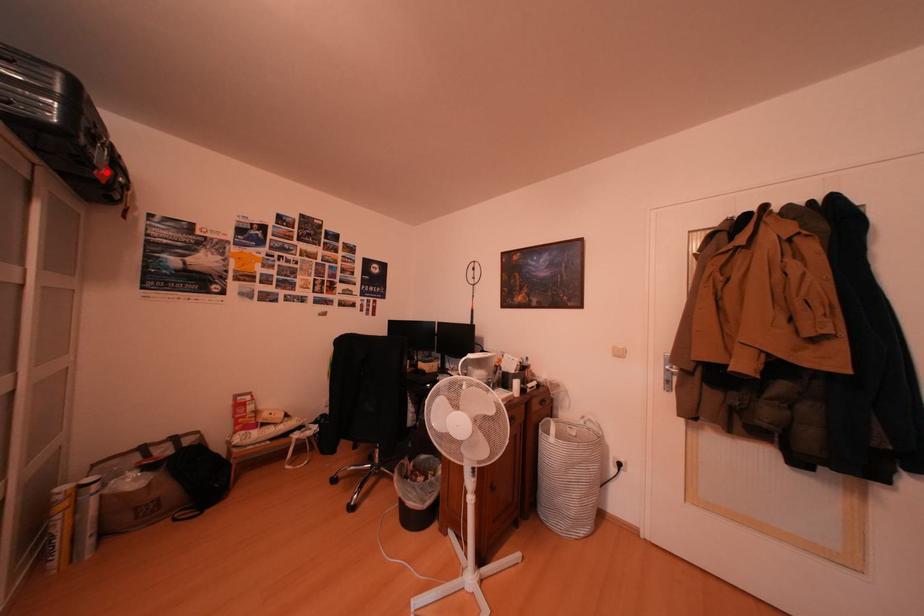
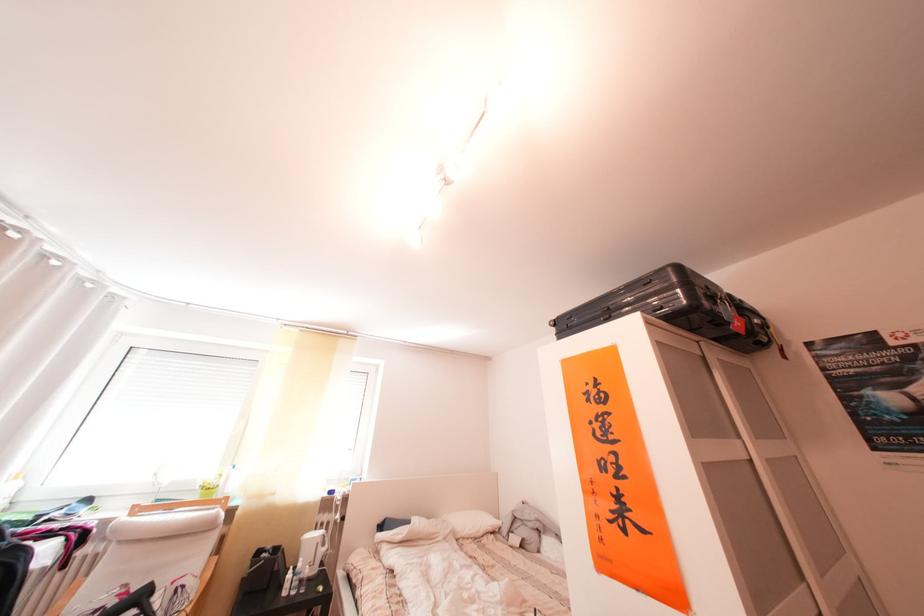
Question: I am providing you with two images of the same scene from different viewpoints. A red point is marked on the first image. Is the red point's position out of view in image 2?

Choices:
 (A) Yes
 (B) No

Answer: (B)